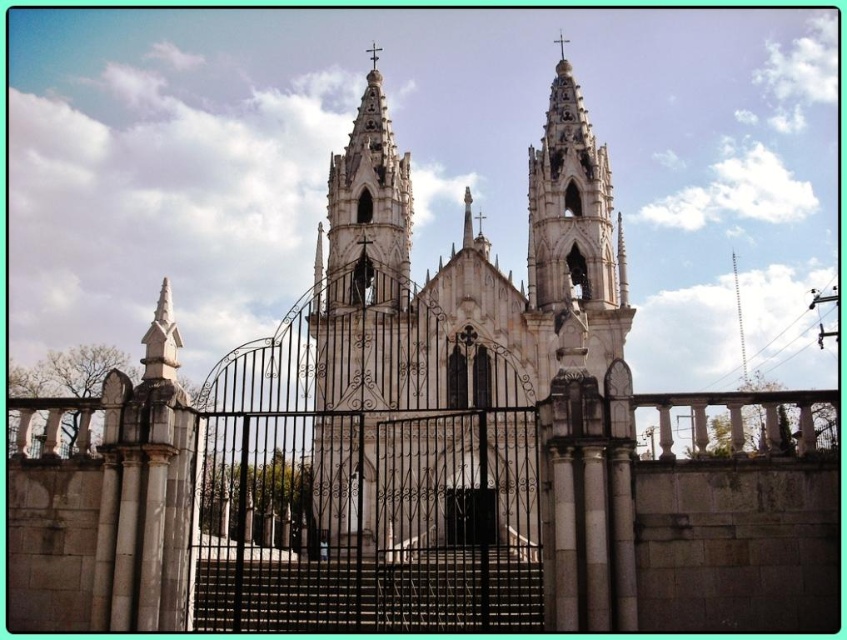
Question: Can you confirm if white stone church at center is smaller than black matte door at center?

Choices:
 (A) no
 (B) yes

Answer: (A)

Question: Does white stone church at center have a greater width compared to black matte door at center?

Choices:
 (A) no
 (B) yes

Answer: (B)

Question: Is white stone church at center positioned at the back of black matte door at center?

Choices:
 (A) yes
 (B) no

Answer: (B)

Question: Which object is farther from the camera taking this photo?

Choices:
 (A) white stone church at center
 (B) black matte door at center

Answer: (B)

Question: Which of the following is the closest to the observer?

Choices:
 (A) (464, 502)
 (B) (604, 204)

Answer: (A)